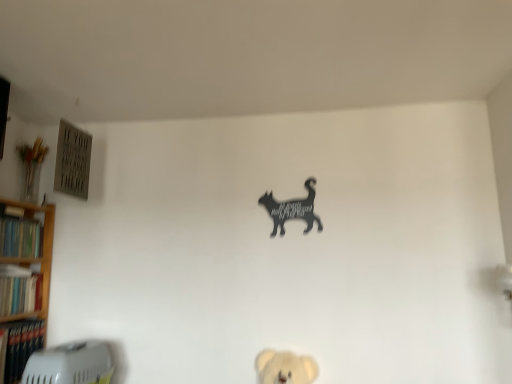
Question: From a real-world perspective, relative to black matte cat at upper center, is hardcover book at left, which is the 1th book from bottom to top, vertically above or below?

Choices:
 (A) above
 (B) below

Answer: (B)

Question: Relative to black matte cat at upper center, is hardcover book at left, which is the 1th book from bottom to top, in front or behind?

Choices:
 (A) front
 (B) behind

Answer: (A)

Question: Which object is the closest to the black matte cat at upper center?

Choices:
 (A) hardcover book at left, the second book positioned from the bottom
 (B) hardcover book at left, the third book from the bottom
 (C) wooden bookshelf at left
 (D) hardcover book at left, which is counted as the third book, starting from the top

Answer: (B)

Question: Considering the real-world distances, which object is farthest from the black matte cat at upper center?

Choices:
 (A) wooden bookshelf at left
 (B) hardcover book at left, the first book from the top
 (C) hardcover book at left, the second book positioned from the bottom
 (D) hardcover book at left, which is counted as the third book, starting from the top

Answer: (D)